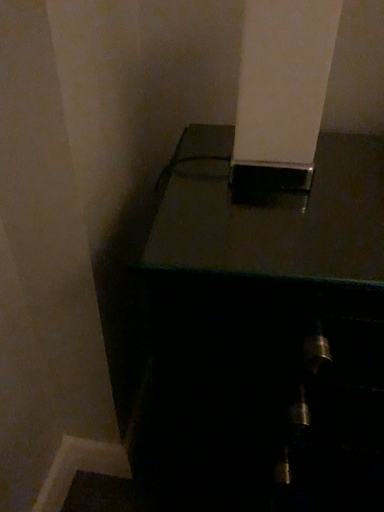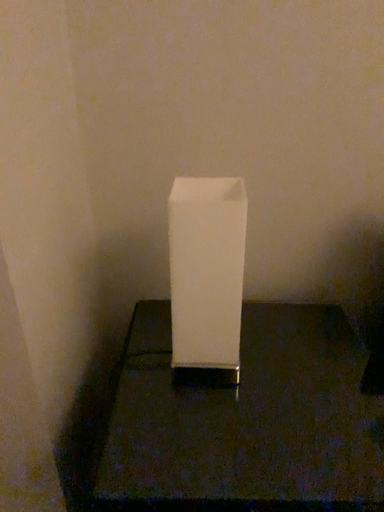
Question: Which way did the camera rotate in the video?

Choices:
 (A) rotated downward
 (B) rotated upward

Answer: (B)